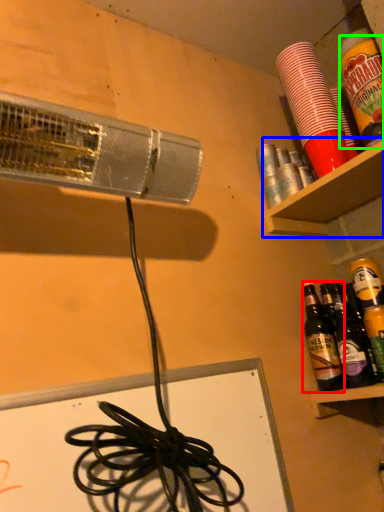
Question: Based on their relative distances, which object is farther from bottle (highlighted by a red box)? Choose from shelf (highlighted by a blue box) and beverage (highlighted by a green box).

Choices:
 (A) shelf
 (B) beverage

Answer: (B)